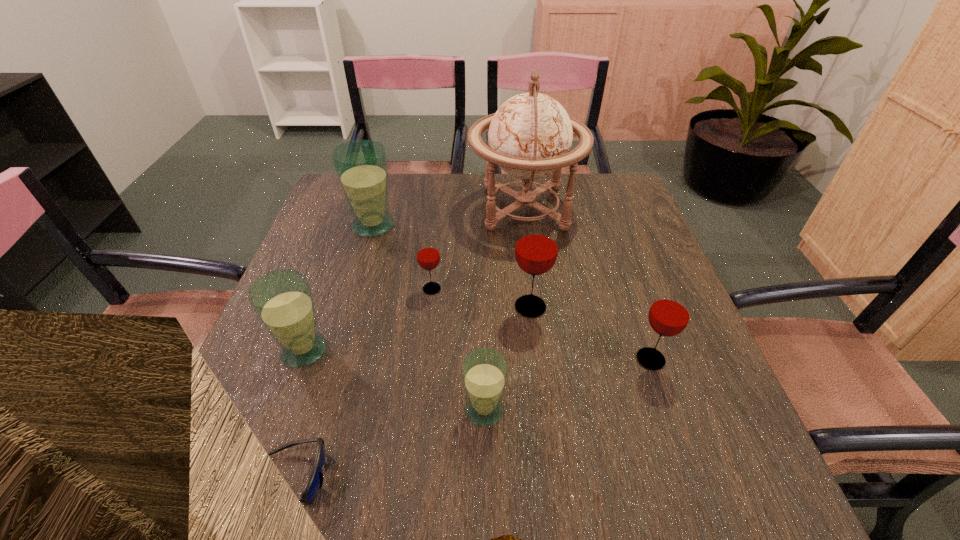
At what (x,y) coordinates should I click in order to perform the action: click on the nearest blue glass. Please return your answer as a coordinate pair (x, y). Image resolution: width=960 pixels, height=540 pixels. Looking at the image, I should click on (484, 372).

At what (x,y) coordinates should I click in order to perform the action: click on the rightmost blue glass. Please return your answer as a coordinate pair (x, y). Image resolution: width=960 pixels, height=540 pixels. Looking at the image, I should click on (484, 372).

Image resolution: width=960 pixels, height=540 pixels. Find the location of `the shortest object`. the shortest object is located at coordinates (314, 483).

Locate an element on the screen. sunglasses is located at coordinates (314, 483).

Locate an element on the screen. This screenshot has width=960, height=540. vacant point located at the front of the globe showing Africa is located at coordinates (373, 208).

Locate an element on the screen. vacant space positioned 0.100m at the front of the globe showing Africa is located at coordinates (435, 208).

You are a GUI agent. You are given a task and a screenshot of the screen. Output one action in this format:
    pyautogui.click(x=<x>, y=<y>)
    Task: Click on the vacant space situated at the front of the globe showing Africa
    
    Given the screenshot: What is the action you would take?
    pyautogui.click(x=431, y=208)

Where is `free region located on the back of the biggest blue glass`? free region located on the back of the biggest blue glass is located at coordinates click(387, 180).

Identify the location of vacant position located on the back of the second red glass from right to left. (527, 276).

In order to click on vacant area situated 0.050m on the right of the second nearest blue glass in this screenshot , I will do `click(354, 350)`.